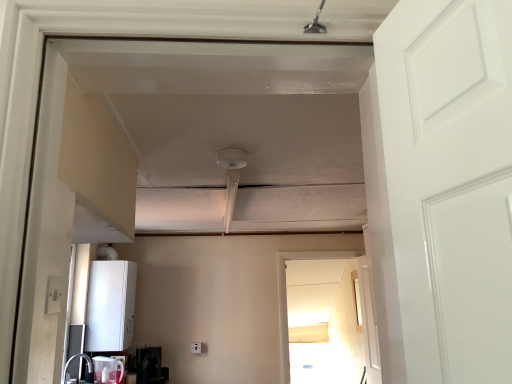
Question: Is white glossy door at right not near transparent glass screen door at center?

Choices:
 (A) yes
 (B) no

Answer: (B)

Question: Does white glossy door at right contain transparent glass screen door at center?

Choices:
 (A) yes
 (B) no

Answer: (B)

Question: Is white glossy door at right to the right of transparent glass screen door at center from the viewer's perspective?

Choices:
 (A) no
 (B) yes

Answer: (B)

Question: From a real-world perspective, is white glossy door at right located beneath transparent glass screen door at center?

Choices:
 (A) no
 (B) yes

Answer: (B)

Question: Can you see white glossy door at right touching transparent glass screen door at center?

Choices:
 (A) no
 (B) yes

Answer: (A)

Question: From the image's perspective, is white glossy door at right located above or below black glossy microwave at lower left, the third appliance in the top-to-bottom sequence?

Choices:
 (A) above
 (B) below

Answer: (A)

Question: Looking at the image, does white glossy door at right seem bigger or smaller compared to black glossy microwave at lower left, the 1th appliance positioned from the bottom?

Choices:
 (A) small
 (B) big

Answer: (B)

Question: Is white glossy door at right situated inside black glossy microwave at lower left, the 1th appliance positioned from the bottom, or outside?

Choices:
 (A) inside
 (B) outside

Answer: (B)

Question: Is point (356, 273) closer or farther from the camera than point (141, 357)?

Choices:
 (A) closer
 (B) farther

Answer: (B)

Question: Is black glossy microwave at lower left, the third appliance in the top-to-bottom sequence, taller or shorter than white plastic electric outlet at lower left?

Choices:
 (A) short
 (B) tall

Answer: (B)

Question: From the image's perspective, is black glossy microwave at lower left, the 1th appliance positioned from the bottom, positioned above or below white plastic electric outlet at lower left?

Choices:
 (A) below
 (B) above

Answer: (A)

Question: Based on their sizes in the image, would you say black glossy microwave at lower left, the 1th appliance positioned from the bottom, is bigger or smaller than white plastic electric outlet at lower left?

Choices:
 (A) small
 (B) big

Answer: (B)

Question: From a real-world perspective, is black glossy microwave at lower left, the third appliance in the top-to-bottom sequence, above or below white plastic electric outlet at lower left?

Choices:
 (A) below
 (B) above

Answer: (A)

Question: Would you say matte white sink at lower left is inside or outside white plastic electric outlet at lower left?

Choices:
 (A) outside
 (B) inside

Answer: (A)

Question: Considering their positions, is matte white sink at lower left located in front of or behind white plastic electric outlet at lower left?

Choices:
 (A) front
 (B) behind

Answer: (B)